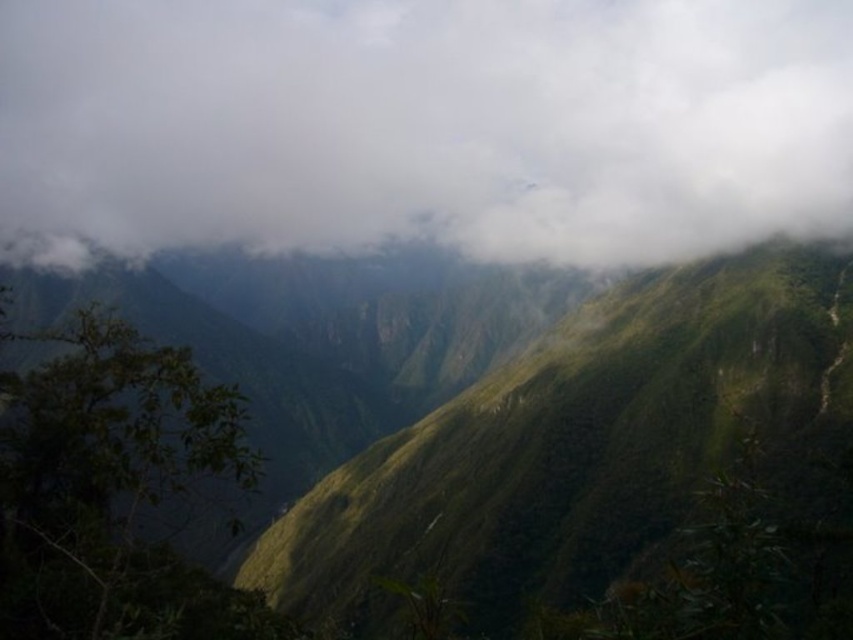
You are a hiker planning to take a photo of the green grassy hillside at center. You notice the white fluffy cloud at upper center might block your view. Based on the scene description, will the cloud obstruct the hillside in your photo?

The green grassy hillside at center is behind the white fluffy cloud at upper center, so the cloud will block the view of the hillside in your photo.

You are an aerial photographer planning to capture the white fluffy cloud at upper center and the green grassy hillside at center in a single shot. Based on the scene, which object would appear larger in the photo?

The white fluffy cloud at upper center is much taller than the green grassy hillside at center, so it would appear larger in the photo.